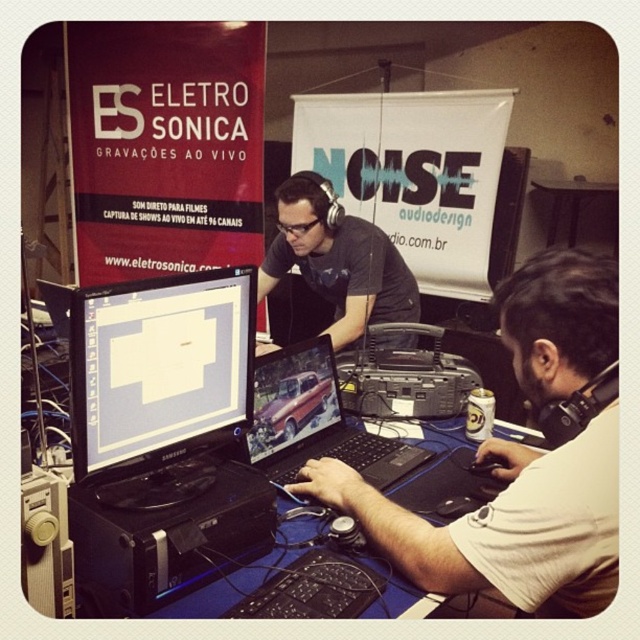
You are a photographer in the room and want to take a photo of the white matte shirt at lower right and the matte black monitor at center. Which object should you focus on first if you want to capture both in a single frame without moving the camera?

The white matte shirt at lower right is taller than the matte black monitor at center, so you should focus on the white matte shirt at lower right first to ensure both are in frame.